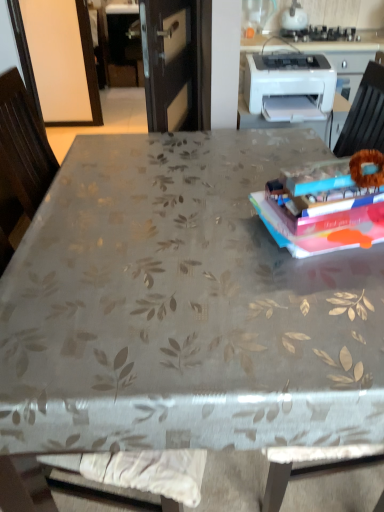
Question: Considering the relative sizes of white glossy countertop at upper center and white plastic printer at upper right in the image provided, is white glossy countertop at upper center shorter than white plastic printer at upper right?

Choices:
 (A) no
 (B) yes

Answer: (B)

Question: From a real-world perspective, is white glossy countertop at upper center beneath white plastic printer at upper right?

Choices:
 (A) yes
 (B) no

Answer: (B)

Question: Can you confirm if white glossy countertop at upper center is wider than white plastic printer at upper right?

Choices:
 (A) yes
 (B) no

Answer: (A)

Question: Is white glossy countertop at upper center at the left side of white plastic printer at upper right?

Choices:
 (A) no
 (B) yes

Answer: (A)

Question: Could white plastic printer at upper right be considered to be inside white glossy countertop at upper center?

Choices:
 (A) yes
 (B) no

Answer: (B)

Question: Is white glossy countertop at upper center bigger than white plastic printer at upper right?

Choices:
 (A) no
 (B) yes

Answer: (A)

Question: From a real-world perspective, is hardcover book at upper right under white glossy kettle at upper center?

Choices:
 (A) no
 (B) yes

Answer: (B)

Question: Is hardcover book at upper right at the right side of white glossy kettle at upper center?

Choices:
 (A) no
 (B) yes

Answer: (A)

Question: From a real-world perspective, does hardcover book at upper right stand above white glossy kettle at upper center?

Choices:
 (A) no
 (B) yes

Answer: (A)

Question: From the image's perspective, is hardcover book at upper right on top of white glossy kettle at upper center?

Choices:
 (A) no
 (B) yes

Answer: (A)

Question: From the image's perspective, is hardcover book at upper right located beneath white glossy kettle at upper center?

Choices:
 (A) no
 (B) yes

Answer: (B)

Question: Does hardcover book at upper right have a greater height compared to white glossy kettle at upper center?

Choices:
 (A) no
 (B) yes

Answer: (A)

Question: Considering the relative positions of white plastic printer at upper right and hardcover book at upper right in the image provided, is white plastic printer at upper right to the right of hardcover book at upper right from the viewer's perspective?

Choices:
 (A) no
 (B) yes

Answer: (B)